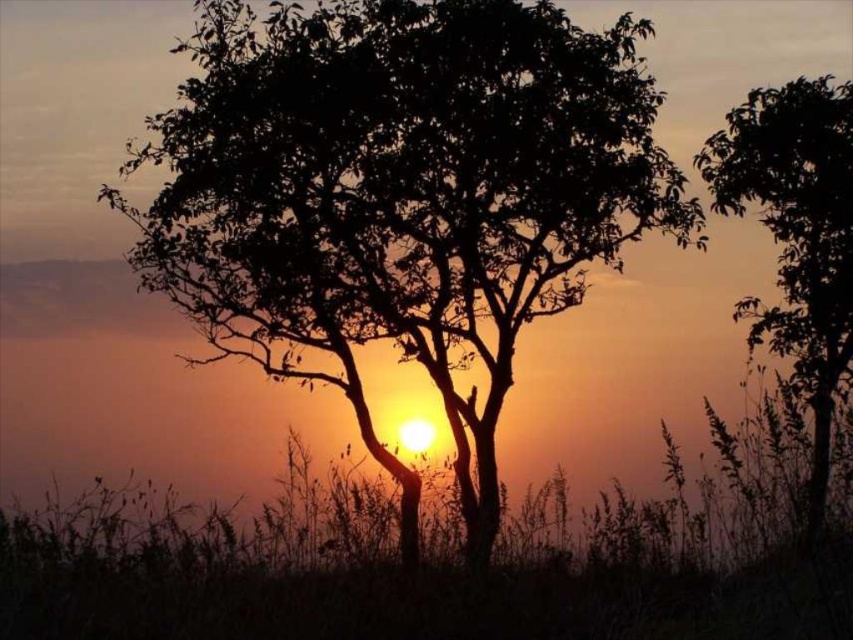
Question: From the image, what is the correct spatial relationship of silhouette leafy tree at center in relation to silhouette leafy tree at right?

Choices:
 (A) above
 (B) below

Answer: (A)

Question: Is silhouette leafy tree at center to the right of silhouette leafy tree at right from the viewer's perspective?

Choices:
 (A) no
 (B) yes

Answer: (A)

Question: Can you confirm if silhouette leafy tree at center is positioned to the right of silhouette leafy tree at right?

Choices:
 (A) yes
 (B) no

Answer: (B)

Question: Which point is closer to the camera?

Choices:
 (A) silhouette leafy tree at right
 (B) silhouette leafy tree at center

Answer: (A)